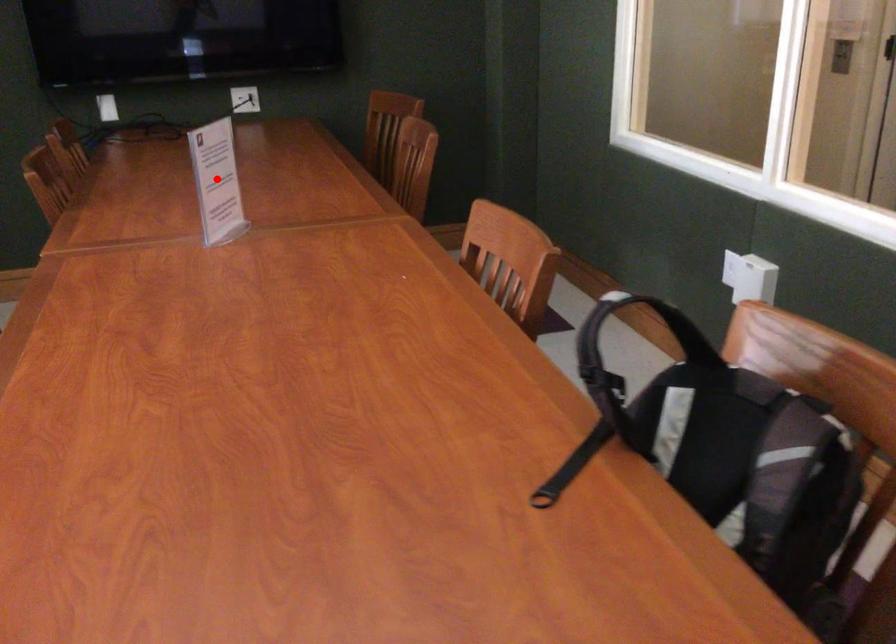
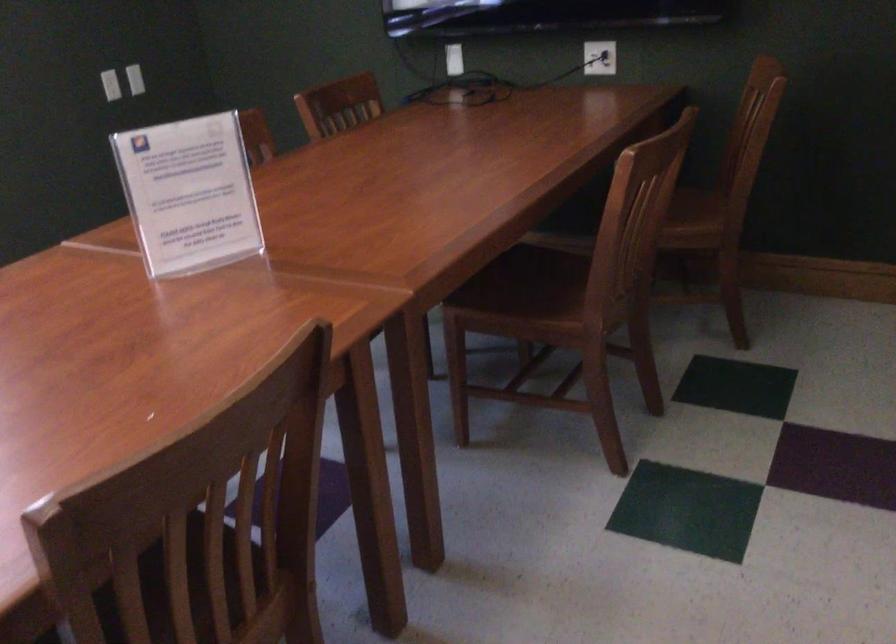
Question: I am providing you with two images of the same scene from different viewpoints. Given a red point in image1, look at the same physical point in image2. Is it:

Choices:
 (A) Closer to the viewpoint
 (B) Farther from the viewpoint

Answer: (A)